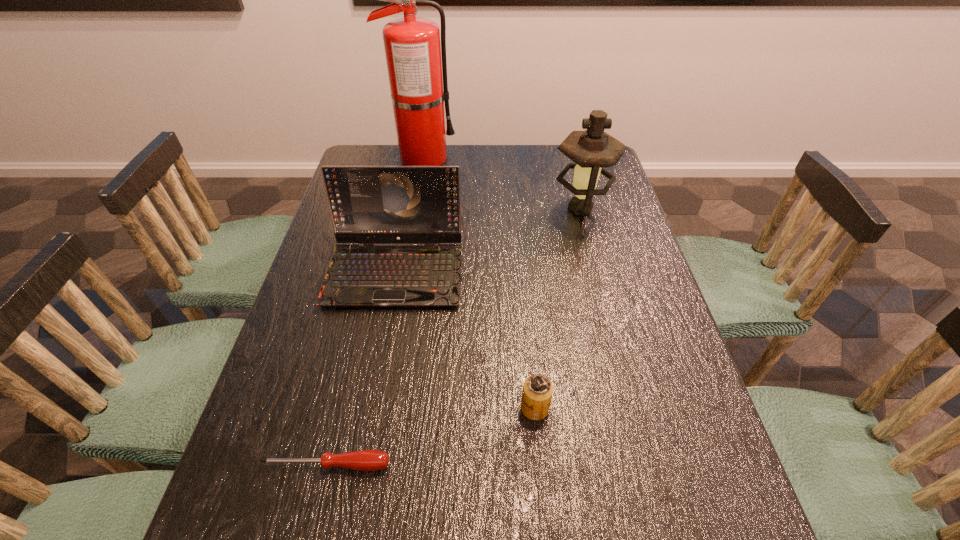
The image size is (960, 540). In order to click on object present at the far left corner in this screenshot , I will do `click(413, 52)`.

The width and height of the screenshot is (960, 540). In order to click on vacant space at the far edge of the desktop in this screenshot , I will do `click(548, 161)`.

At what (x,y) coordinates should I click in order to perform the action: click on vacant space at the left edge of the desktop. Please return your answer as a coordinate pair (x, y). This screenshot has width=960, height=540. Looking at the image, I should click on (252, 425).

The image size is (960, 540). I want to click on free space at the right edge of the desktop, so click(617, 344).

Locate an element on the screen. The width and height of the screenshot is (960, 540). vacant space at the far left corner of the desktop is located at coordinates (393, 145).

The width and height of the screenshot is (960, 540). I want to click on vacant space that's between the second farthest object and the tallest object, so click(501, 183).

This screenshot has width=960, height=540. Identify the location of free spot between the screwdriver and the laptop computer. (361, 368).

I want to click on empty location between the shortest object and the laptop computer, so click(361, 368).

Find the location of a particular element. This screenshot has height=540, width=960. free spot between the fire extinguisher and the rightmost object is located at coordinates (501, 183).

Locate an element on the screen. This screenshot has width=960, height=540. free point between the third nearest object and the second farthest object is located at coordinates (488, 239).